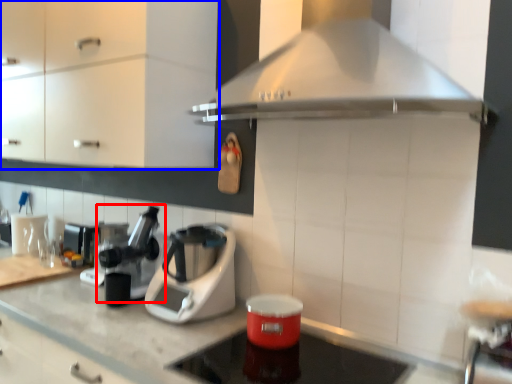
Question: Which object appears farthest to the camera in this image, coffee machine (highlighted by a red box) or cabinetry (highlighted by a blue box)?

Choices:
 (A) coffee machine
 (B) cabinetry

Answer: (A)